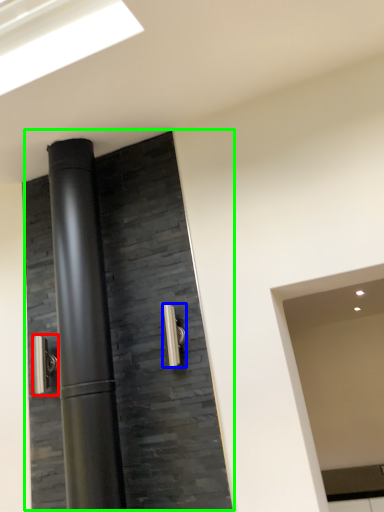
Question: Which object is positioned farthest from door handle (highlighted by a red box)? Select from door handle (highlighted by a blue box) and door (highlighted by a green box).

Choices:
 (A) door handle
 (B) door

Answer: (A)